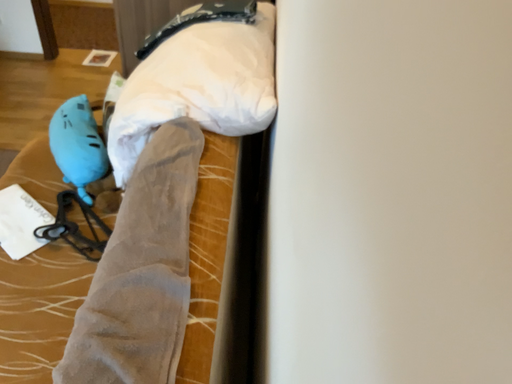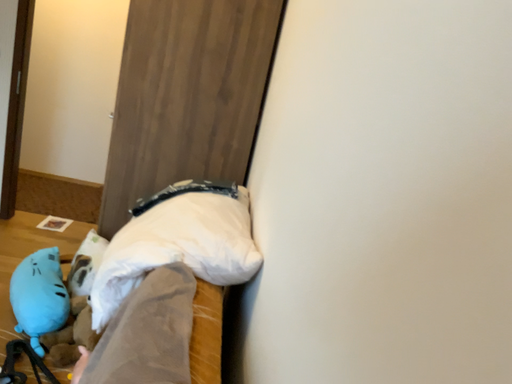
Question: How did the camera likely rotate when shooting the video?

Choices:
 (A) rotated upward
 (B) rotated downward

Answer: (A)